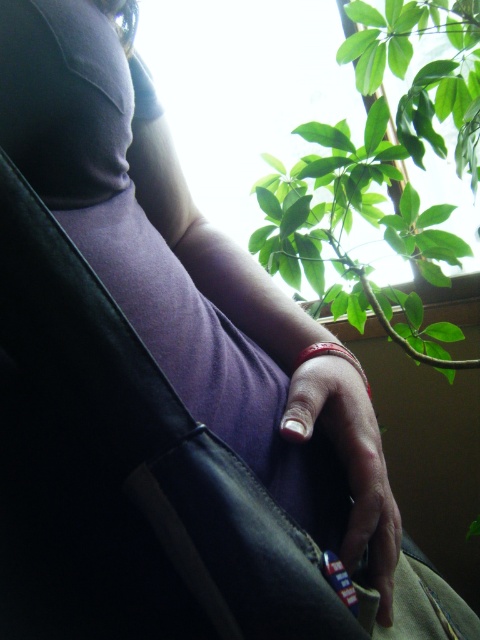
You are a photographer setting up a shoot in this room. You want to ensure that the green leafy plant at upper right and the white matte nail at center are both visible in the frame. Given their sizes, which object should you prioritize positioning closer to the camera to maintain clarity?

The green leafy plant at upper right is taller than white matte nail at center. To ensure both are visible and maintain clarity, prioritize positioning the white matte nail at center closer to the camera since it is smaller and might be harder to see from a distance.

You are a photographer setting up a shoot in this room. You want to ensure the green leafy plant at upper right and the white matte nail at center are both visible in the frame. Which object should be placed to the right side of the other?

The green leafy plant at upper right is positioned on the right side of white matte nail at center, so to have both visible, the photographer should ensure the green leafy plant at upper right is to the right of the white matte nail at center.

You are an interior designer working on a project and need to place a decorative item exactly at the coordinates where the white matte nail at center is located. What object in the scene is positioned at those coordinates?

The white matte nail at center is positioned at coordinates point [350,460].